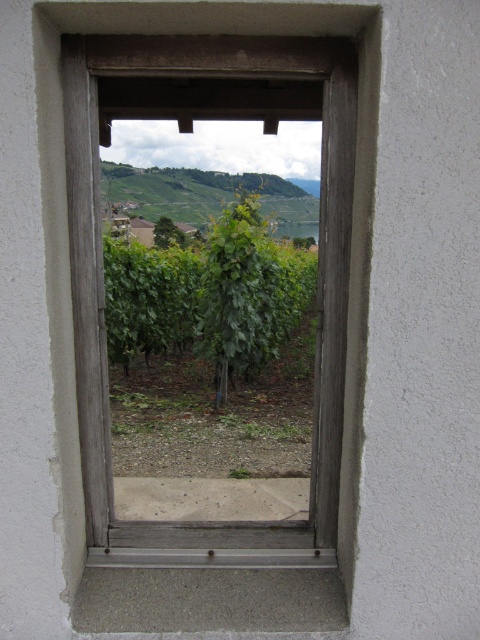
Does point (149, 22) come closer to viewer compared to point (220, 378)?

That is True.

Between wooden frame at center and green leafy vine at center, which one appears on the left side from the viewer's perspective?

From the viewer's perspective, wooden frame at center appears more on the left side.

Does point (72, 513) come in front of point (146, 314)?

Yes, point (72, 513) is in front of point (146, 314).

Where is `wooden frame at center`? This screenshot has width=480, height=640. wooden frame at center is located at coordinates (66, 211).